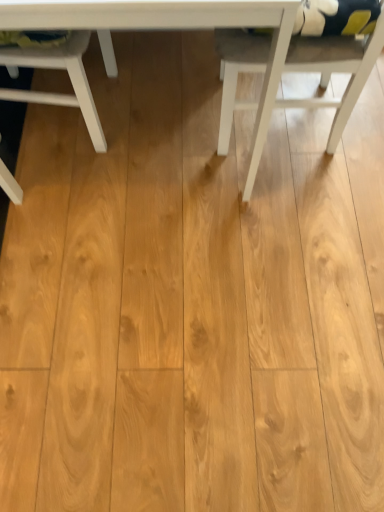
Question: Can you confirm if white matte chair at upper left, positioned as the first chair in left-to-right order, is thinner than white wood table at center?

Choices:
 (A) no
 (B) yes

Answer: (B)

Question: Does white matte chair at upper left, arranged as the second chair when viewed from the right, appear on the left side of white wood table at center?

Choices:
 (A) yes
 (B) no

Answer: (A)

Question: Can you confirm if white matte chair at upper left, arranged as the second chair when viewed from the right, is shorter than white wood table at center?

Choices:
 (A) no
 (B) yes

Answer: (B)

Question: Is white matte chair at upper left, arranged as the second chair when viewed from the right, aimed at white wood table at center?

Choices:
 (A) no
 (B) yes

Answer: (B)

Question: Does white matte chair at upper left, arranged as the second chair when viewed from the right, appear on the right side of white wood table at center?

Choices:
 (A) yes
 (B) no

Answer: (B)

Question: Is white matte chair at upper left, arranged as the second chair when viewed from the right, in front of or behind white wood table at center in the image?

Choices:
 (A) behind
 (B) front

Answer: (A)

Question: From a real-world perspective, is white matte chair at upper left, arranged as the second chair when viewed from the right, physically located above or below white wood table at center?

Choices:
 (A) below
 (B) above

Answer: (A)

Question: Is white matte chair at upper left, positioned as the first chair in left-to-right order, wider or thinner than white wood table at center?

Choices:
 (A) wide
 (B) thin

Answer: (B)

Question: From the image's perspective, is white matte chair at upper left, arranged as the second chair when viewed from the right, above or below white wood table at center?

Choices:
 (A) above
 (B) below

Answer: (B)

Question: From a real-world perspective, is white matte chair at right, placed as the 1th chair when sorted from right to left, positioned above or below white matte chair at upper left, arranged as the second chair when viewed from the right?

Choices:
 (A) below
 (B) above

Answer: (B)

Question: In the image, is white matte chair at right, placed as the 1th chair when sorted from right to left, positioned in front of or behind white matte chair at upper left, positioned as the first chair in left-to-right order?

Choices:
 (A) front
 (B) behind

Answer: (A)

Question: Considering the positions of white matte chair at right, which is the second chair in left-to-right order, and white matte chair at upper left, positioned as the first chair in left-to-right order, in the image, is white matte chair at right, which is the second chair in left-to-right order, wider or thinner than white matte chair at upper left, positioned as the first chair in left-to-right order,?

Choices:
 (A) thin
 (B) wide

Answer: (A)

Question: Is white matte chair at right, placed as the 1th chair when sorted from right to left, to the left or to the right of white matte chair at upper left, positioned as the first chair in left-to-right order, in the image?

Choices:
 (A) left
 (B) right

Answer: (B)

Question: Which is correct: white wood table at center is inside white matte chair at right, placed as the 1th chair when sorted from right to left, or outside of it?

Choices:
 (A) outside
 (B) inside

Answer: (A)

Question: From a real-world perspective, is white wood table at center positioned above or below white matte chair at right, which is the second chair in left-to-right order?

Choices:
 (A) above
 (B) below

Answer: (A)